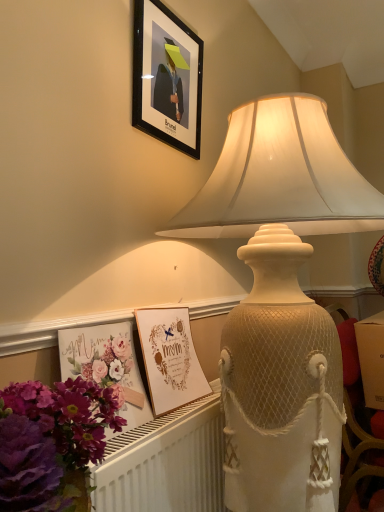
Question: From the image's perspective, is matte gold postcard at lower center, which is counted as the 1th postcard, starting from the back, above or below purple floral bouquet at lower left?

Choices:
 (A) above
 (B) below

Answer: (A)

Question: In the image, is matte gold postcard at lower center, which is counted as the 1th postcard, starting from the back, positioned in front of or behind purple floral bouquet at lower left?

Choices:
 (A) behind
 (B) front

Answer: (A)

Question: Which object is the farthest from the matte gold postcard at lower center, arranged as the 2th postcard when viewed from the front?

Choices:
 (A) white textured radiator at lower left
 (B) floral paper postcard at lower left, placed as the 2th postcard when sorted from back to front
 (C) purple floral bouquet at lower left
 (D) matte cream lampshade at upper center
 (E) black matte picture frame at upper center

Answer: (E)

Question: Which of these objects is positioned farthest from the white textured radiator at lower left?

Choices:
 (A) purple floral bouquet at lower left
 (B) floral paper postcard at lower left, which ranks as the 1th postcard in front-to-back order
 (C) matte gold postcard at lower center, arranged as the 2th postcard when viewed from the front
 (D) matte cream lampshade at upper center
 (E) black matte picture frame at upper center

Answer: (E)